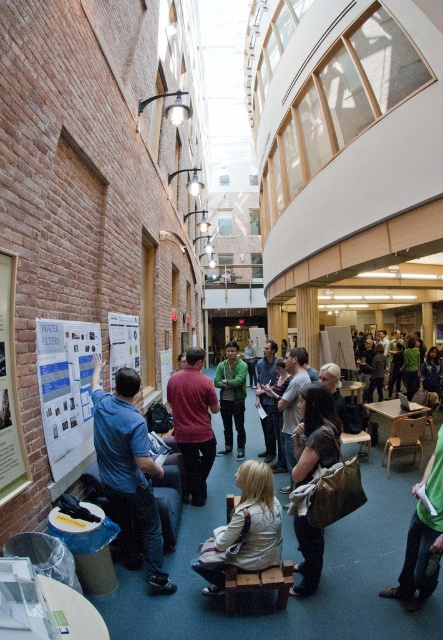
You are standing at the point marked as point (225, 445). You want to walk to the nearest exit, which is located at the opposite corner of the room. The room is 20 feet long. Can you reach the exit without crossing the 20 feet distance?

The distance between you and the exit is 19.92 feet, which is less than the room length of 20 feet. Therefore, you can reach the exit without crossing the 20 feet distance.

You are standing in the center of the room and want to pick up the white paper at left. Can you reach it without moving the green matte jacket at center?

The white paper at left is behind the green matte jacket at center, so you cannot reach it without moving the green matte jacket at center.

You are at an event and want to see the white paperboard at left clearly. However, the brown textured bag at center is blocking your view. Can you move around it to get a better look?

The white paperboard at left is behind the brown textured bag at center, so moving around the brown textured bag at center should allow you to see the white paperboard at left more clearly.